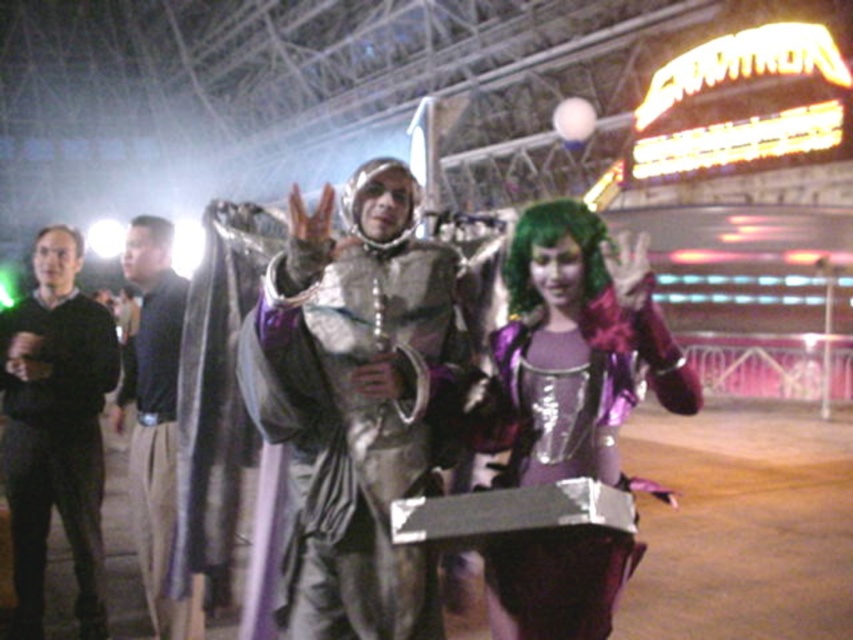
Is point (62, 256) positioned before point (80, 248)?

That is True.

This screenshot has width=853, height=640. What do you see at coordinates (55, 433) in the screenshot?
I see `black matte sweater at left` at bounding box center [55, 433].

The image size is (853, 640). I want to click on black matte sweater at left, so click(55, 433).

Who is lower down, metallic silver costume at center or shiny purple dress at center?

Positioned lower is metallic silver costume at center.

I want to click on metallic silver costume at center, so click(x=363, y=401).

Which is in front, point (155, 458) or point (78, 243)?

Point (155, 458) is more forward.

Consider the image. Does dark brown leather jacket at left appear on the right side of shiny black wig at upper left?

Correct, you'll find dark brown leather jacket at left to the right of shiny black wig at upper left.

Is point (189, 621) in front of point (44, 230)?

Yes, it is.

You are a GUI agent. You are given a task and a screenshot of the screen. Output one action in this format:
    pyautogui.click(x=<x>, y=<y>)
    Task: Click on the dark brown leather jacket at left
    Image resolution: width=853 pixels, height=640 pixels.
    Given the screenshot: What is the action you would take?
    pyautogui.click(x=154, y=428)